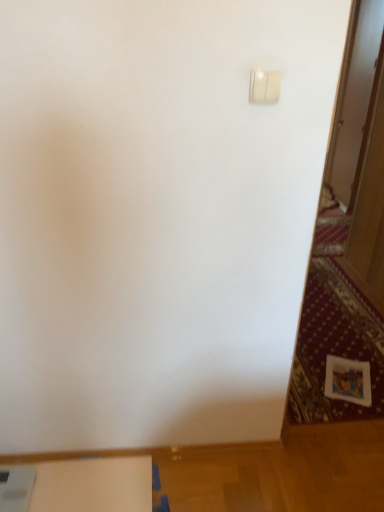
Question: Is white plastic light switch at upper right not inside white matte table at lower left?

Choices:
 (A) no
 (B) yes

Answer: (B)

Question: Considering the relative sizes of white plastic light switch at upper right and white matte table at lower left in the image provided, is white plastic light switch at upper right thinner than white matte table at lower left?

Choices:
 (A) yes
 (B) no

Answer: (A)

Question: Is white plastic light switch at upper right at the left side of white matte table at lower left?

Choices:
 (A) yes
 (B) no

Answer: (B)

Question: Does white plastic light switch at upper right appear on the right side of white matte table at lower left?

Choices:
 (A) yes
 (B) no

Answer: (A)

Question: Considering the relative sizes of white plastic light switch at upper right and white matte table at lower left in the image provided, is white plastic light switch at upper right wider than white matte table at lower left?

Choices:
 (A) no
 (B) yes

Answer: (A)

Question: From a real-world perspective, does white plastic light switch at upper right sit lower than white matte table at lower left?

Choices:
 (A) no
 (B) yes

Answer: (A)

Question: Can white plastic light switch at upper right be found inside white matte table at lower left?

Choices:
 (A) no
 (B) yes

Answer: (A)

Question: From the image's perspective, is white matte table at lower left below white plastic light switch at upper right?

Choices:
 (A) no
 (B) yes

Answer: (B)

Question: Can you confirm if white matte table at lower left is smaller than white plastic light switch at upper right?

Choices:
 (A) yes
 (B) no

Answer: (B)

Question: From a real-world perspective, is white matte table at lower left on white plastic light switch at upper right?

Choices:
 (A) yes
 (B) no

Answer: (B)

Question: Is white matte table at lower left positioned behind white plastic light switch at upper right?

Choices:
 (A) no
 (B) yes

Answer: (B)

Question: From the image's perspective, is white matte table at lower left located above white plastic light switch at upper right?

Choices:
 (A) no
 (B) yes

Answer: (A)

Question: From the image's perspective, relative to white plastic light switch at upper right, is white matte table at lower left above or below?

Choices:
 (A) above
 (B) below

Answer: (B)